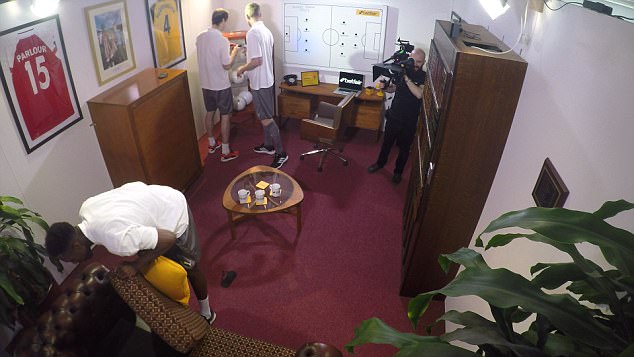
Where is `framed picture`? framed picture is located at coordinates (108, 43).